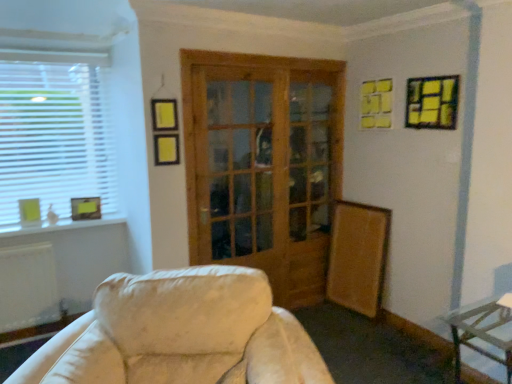
Find the location of a particular element. free space above wooden glass door at center (from a real-world perspective) is located at coordinates (278, 52).